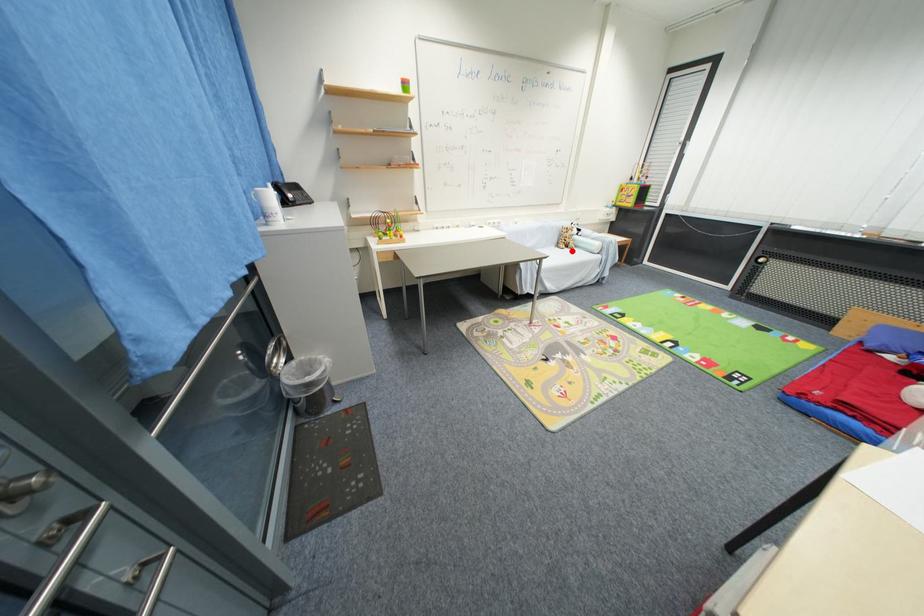
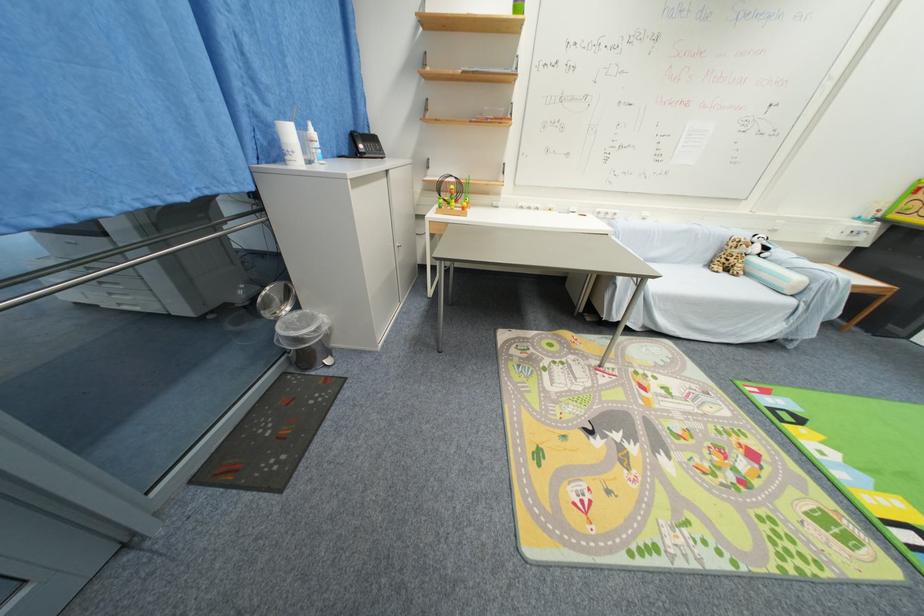
The point at the highlighted location is marked in the first image. Where is the corresponding point in the second image?

(730, 276)